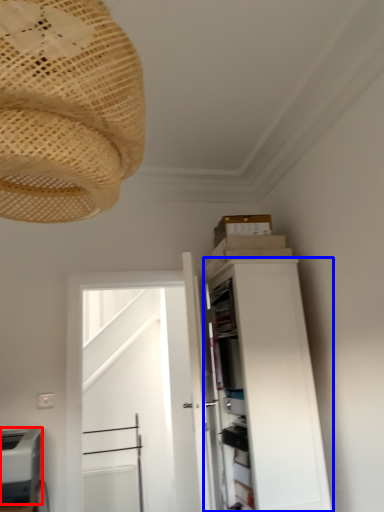
Question: Which object is further to the camera taking this photo, appliance (highlighted by a red box) or cabinetry (highlighted by a blue box)?

Choices:
 (A) appliance
 (B) cabinetry

Answer: (B)